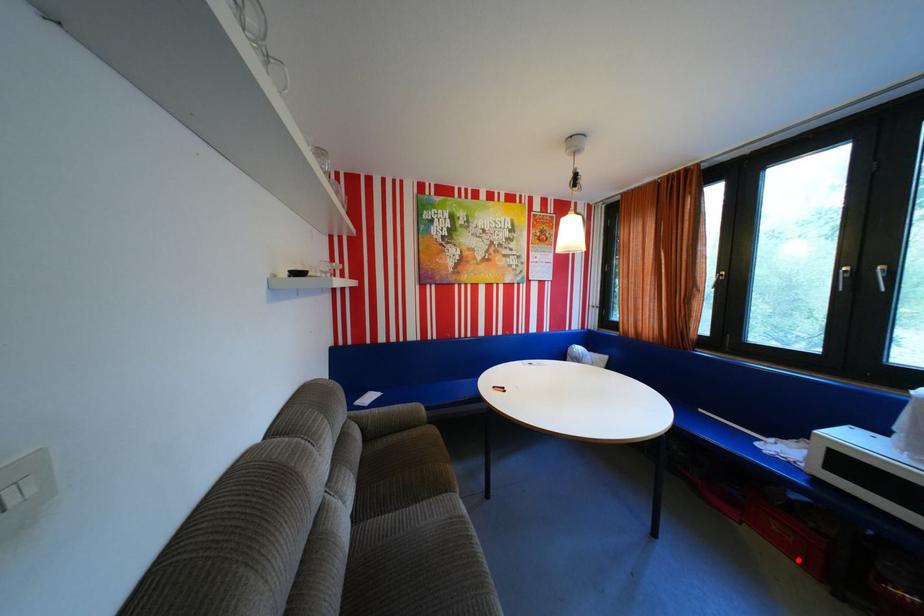
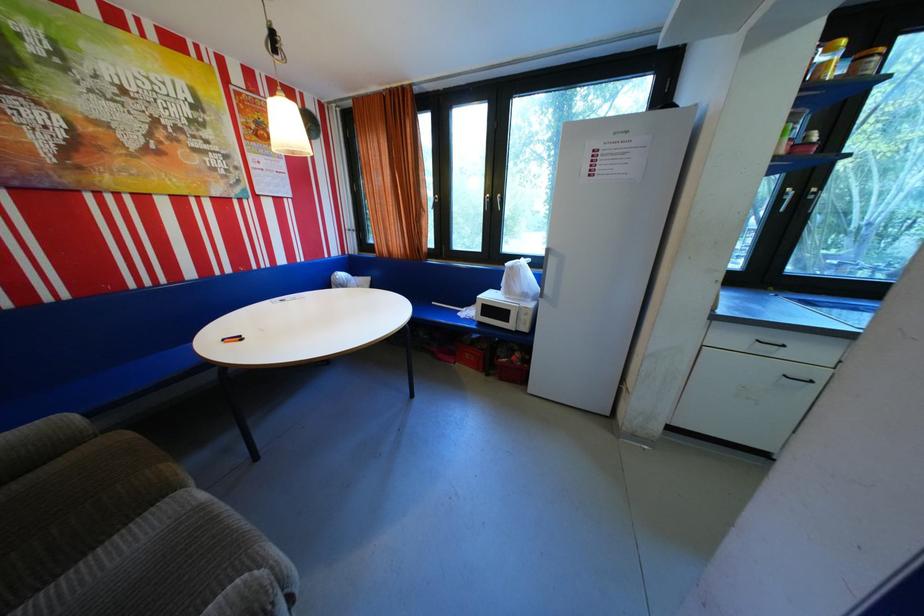
Question: I am providing you with two images of the same scene from different viewpoints. In image1, a red point is highlighted. Considering the same 3D point in image2, which of the following is correct?

Choices:
 (A) It is closer
 (B) It is farther

Answer: (B)